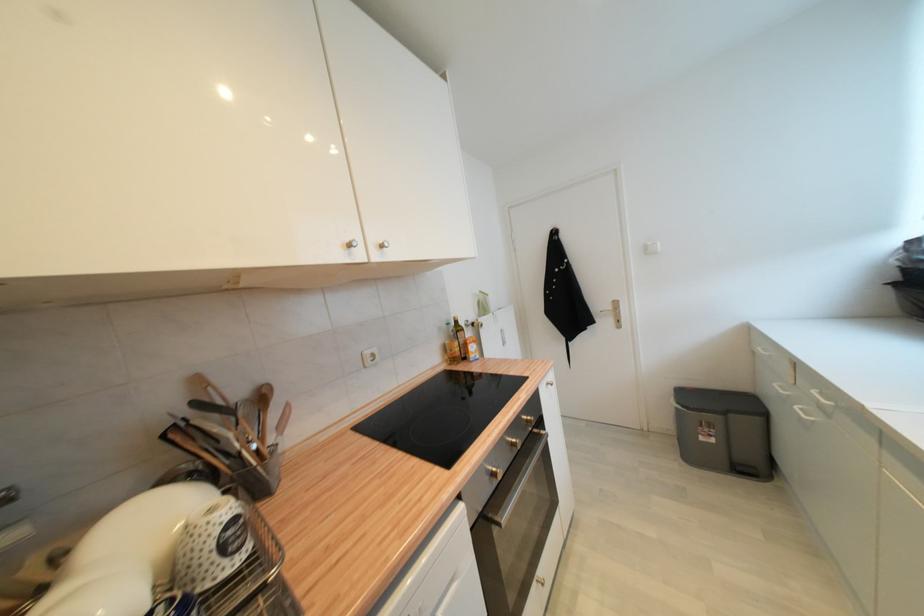
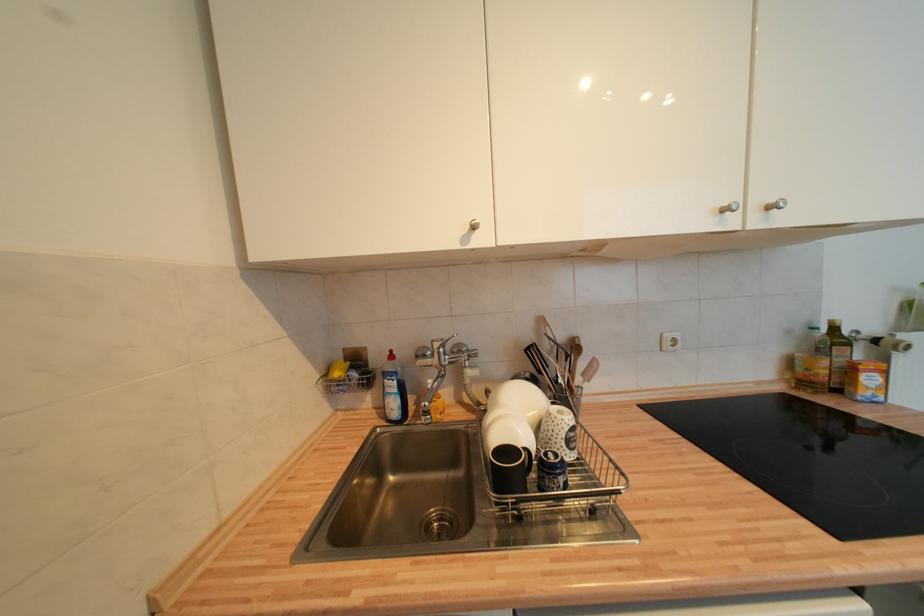
In the second image, find the point that corresponds to (453,326) in the first image.

(819, 331)